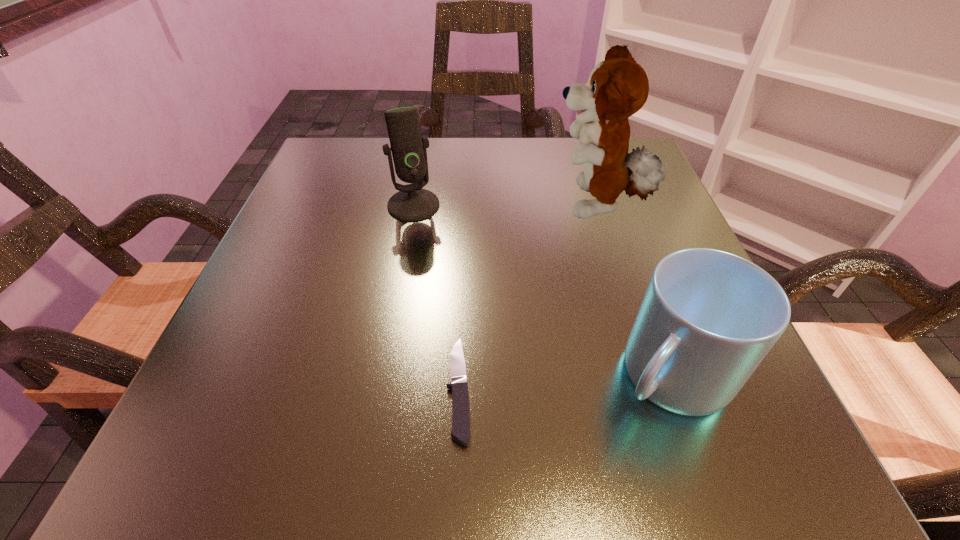
At what (x,y) coordinates should I click in order to perform the action: click on free spot that satisfies the following two spatial constraints: 1. on the front side of the leftmost object; 2. on the right side of the steak knife. Please return your answer as a coordinate pair (x, y). Looking at the image, I should click on (380, 389).

The width and height of the screenshot is (960, 540). In order to click on vacant area that satisfies the following two spatial constraints: 1. on the face of the second shortest object; 2. on the left side of the puppy in this screenshot , I will do tap(649, 375).

Where is `free location that satisfies the following two spatial constraints: 1. on the face of the mug; 2. on the right side of the puppy`? Image resolution: width=960 pixels, height=540 pixels. free location that satisfies the following two spatial constraints: 1. on the face of the mug; 2. on the right side of the puppy is located at coordinates (649, 375).

This screenshot has height=540, width=960. I want to click on vacant space that satisfies the following two spatial constraints: 1. on the face of the puppy; 2. on the left side of the third tallest object, so click(649, 375).